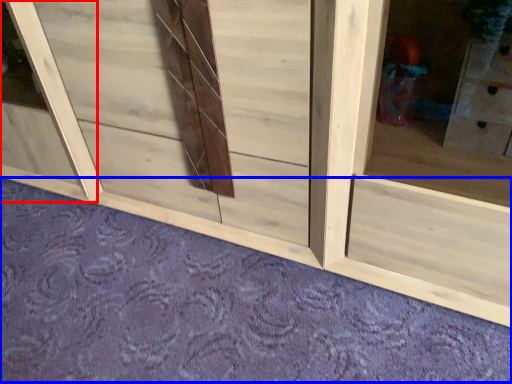
Question: Which point is further to the camera, window frame (highlighted by a red box) or plain (highlighted by a blue box)?

Choices:
 (A) window frame
 (B) plain

Answer: (A)